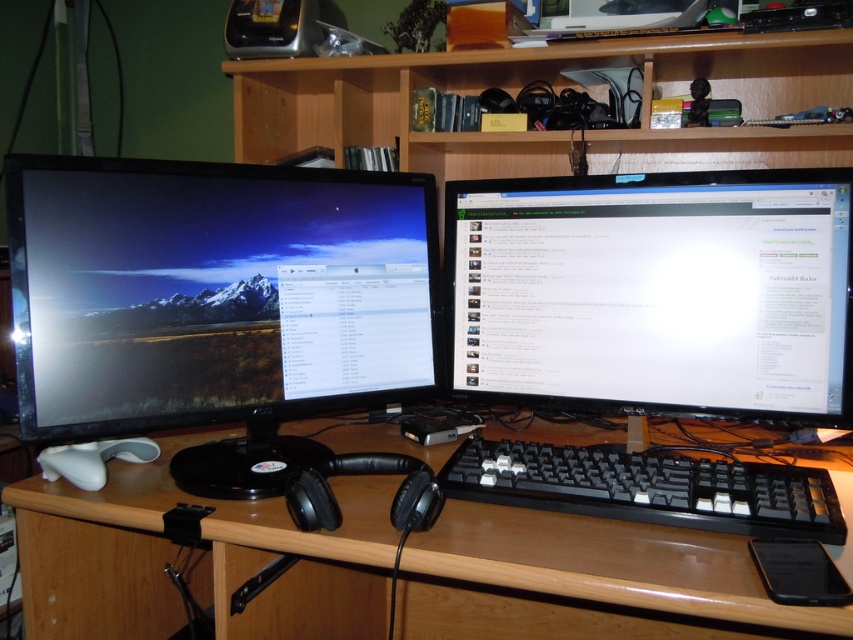
You are standing in front of a desk with a wooden surface at center. If you want to place a 24 inch laptop on the desk, will it fit in the space between the wooden at center and the edge closest to you?

The wooden at center is 24.50 inches from the viewer, so placing a 24 inch laptop would fit since the distance is slightly larger than the laptop.